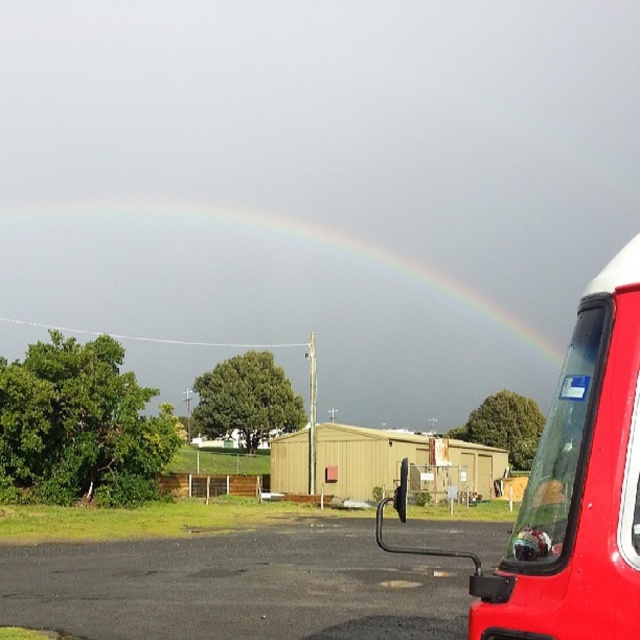
Is black asphalt parking lot at lower left in front of rainbow at upper center?

Yes, it is.

Can you confirm if black asphalt parking lot at lower left is positioned below rainbow at upper center?

Yes.

Identify the location of black asphalt parking lot at lower left. (236, 586).

The width and height of the screenshot is (640, 640). I want to click on black asphalt parking lot at lower left, so click(x=236, y=586).

Is point (196, 596) more distant than point (611, 424)?

Yes, point (196, 596) is behind point (611, 424).

Can you confirm if black asphalt parking lot at lower left is thinner than shiny red truck at right?

In fact, black asphalt parking lot at lower left might be wider than shiny red truck at right.

Is point (321, 525) farther from camera compared to point (476, 570)?

That is True.

In order to click on black asphalt parking lot at lower left in this screenshot , I will do `click(236, 586)`.

Is point (544, 582) behind point (403, 269)?

No, it is not.

Between point (556, 554) and point (269, 230), which one is positioned behind?

The point (269, 230) is more distant.

This screenshot has width=640, height=640. What are the coordinates of `shiny red truck at right` in the screenshot? It's located at (572, 488).